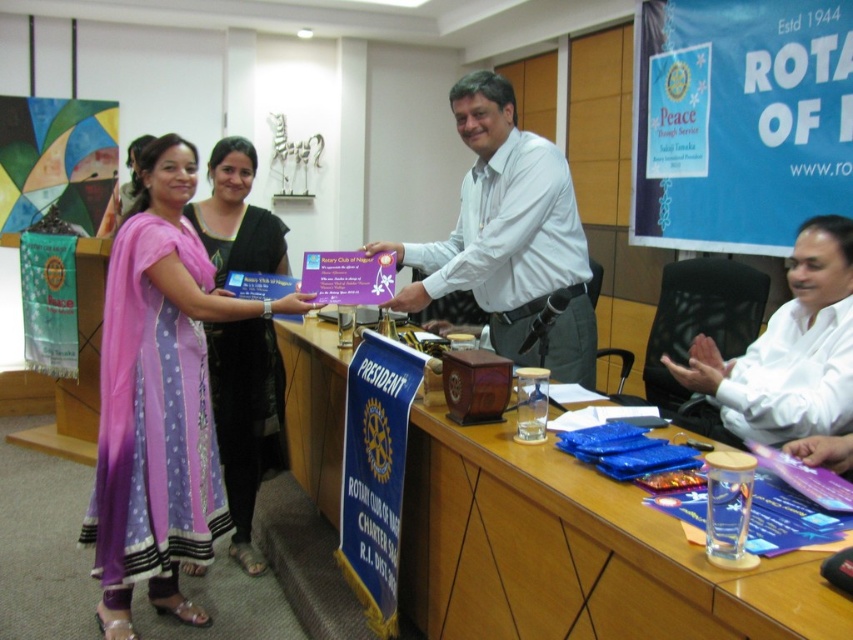
Does purple satin kurta at left appear under white glossy shirt at right?

Indeed, purple satin kurta at left is positioned under white glossy shirt at right.

Can you confirm if purple satin kurta at left is positioned to the right of white glossy shirt at right?

No, purple satin kurta at left is not to the right of white glossy shirt at right.

Who is more distant from viewer, (169, 404) or (836, 369)?

Positioned behind is point (169, 404).

The image size is (853, 640). In order to click on purple satin kurta at left in this screenshot , I will do click(x=160, y=397).

Does white glossy shirt at right have a lesser width compared to purple satin saree at left?

No.

Does point (834, 298) come farther from viewer compared to point (222, 337)?

No, it is in front of (222, 337).

Which is behind, point (795, 433) or point (250, 556)?

The point (250, 556) is behind.

At what (x,y) coordinates should I click in order to perform the action: click on white glossy shirt at right. Please return your answer as a coordinate pair (x, y). Image resolution: width=853 pixels, height=640 pixels. Looking at the image, I should click on (788, 352).

Measure the distance between purple satin kurta at left and white glossy shirt at center.

purple satin kurta at left is 29.69 inches away from white glossy shirt at center.

Who is positioned more to the left, purple satin kurta at left or white glossy shirt at center?

Positioned to the left is purple satin kurta at left.

Find the location of a particular element. This screenshot has width=853, height=640. purple satin kurta at left is located at coordinates (160, 397).

Identify the location of purple satin kurta at left. This screenshot has height=640, width=853. (160, 397).